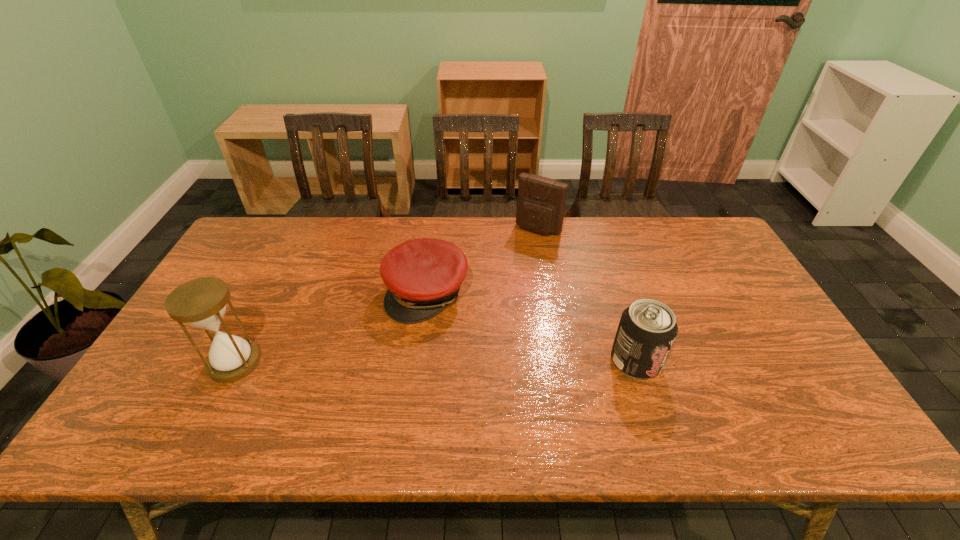
I want to click on vacant space at the near edge of the desktop, so click(647, 387).

Where is `free space at the far left corner of the desktop`? The width and height of the screenshot is (960, 540). free space at the far left corner of the desktop is located at coordinates (268, 228).

Locate an element on the screen. The image size is (960, 540). blank area at the near left corner is located at coordinates (198, 407).

At what (x,y) coordinates should I click in order to perform the action: click on free space at the far right corner. Please return your answer as a coordinate pair (x, y). This screenshot has width=960, height=540. Looking at the image, I should click on (696, 232).

Image resolution: width=960 pixels, height=540 pixels. Find the location of `free spot between the soda can and the tallest object`. free spot between the soda can and the tallest object is located at coordinates (435, 362).

Identify the location of free space between the third nearest object and the tallest object. The width and height of the screenshot is (960, 540). (331, 327).

The width and height of the screenshot is (960, 540). I want to click on vacant space that is in between the soda can and the shortest object, so (x=532, y=327).

The image size is (960, 540). Identify the location of free space between the shortest object and the farthest object. (483, 261).

You are a GUI agent. You are given a task and a screenshot of the screen. Output one action in this format:
    pyautogui.click(x=<x>, y=<y>)
    Task: Click on the free space that is in between the farthest object and the third object from right to left
    Image resolution: width=960 pixels, height=540 pixels.
    Given the screenshot: What is the action you would take?
    pyautogui.click(x=483, y=261)

The image size is (960, 540). What are the coordinates of `free space between the farthest object and the rightmost object` in the screenshot? It's located at (587, 295).